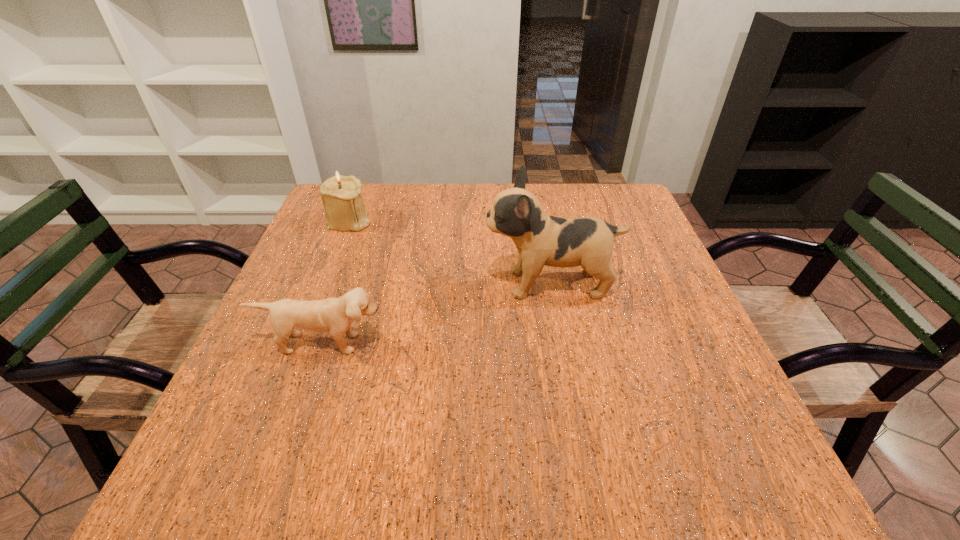
Identify the location of blank space at the near left corner of the desktop. This screenshot has height=540, width=960. click(266, 492).

The height and width of the screenshot is (540, 960). In the image, there is a desktop. In order to click on free region at the far right corner in this screenshot , I will do `click(614, 207)`.

In order to click on vacant area that lies between the farthest object and the rightmost object in this screenshot , I will do `click(450, 252)`.

Where is `vacant space in between the shortest object and the farthest object`? The image size is (960, 540). vacant space in between the shortest object and the farthest object is located at coordinates (336, 282).

Locate an element on the screen. The height and width of the screenshot is (540, 960). unoccupied area between the second nearest object and the candle_holder is located at coordinates (450, 252).

Where is `vacant area that lies between the candle_holder and the nearer puppy`? The height and width of the screenshot is (540, 960). vacant area that lies between the candle_holder and the nearer puppy is located at coordinates (336, 282).

This screenshot has height=540, width=960. What are the coordinates of `free space between the tallest object and the nearer puppy` in the screenshot? It's located at (437, 314).

The width and height of the screenshot is (960, 540). I want to click on empty space that is in between the taller puppy and the nearer puppy, so click(x=437, y=314).

Identify the location of vacant space in between the left puppy and the farthest object. (336, 282).

The image size is (960, 540). In order to click on free space between the shorter puppy and the farthest object in this screenshot , I will do `click(336, 282)`.